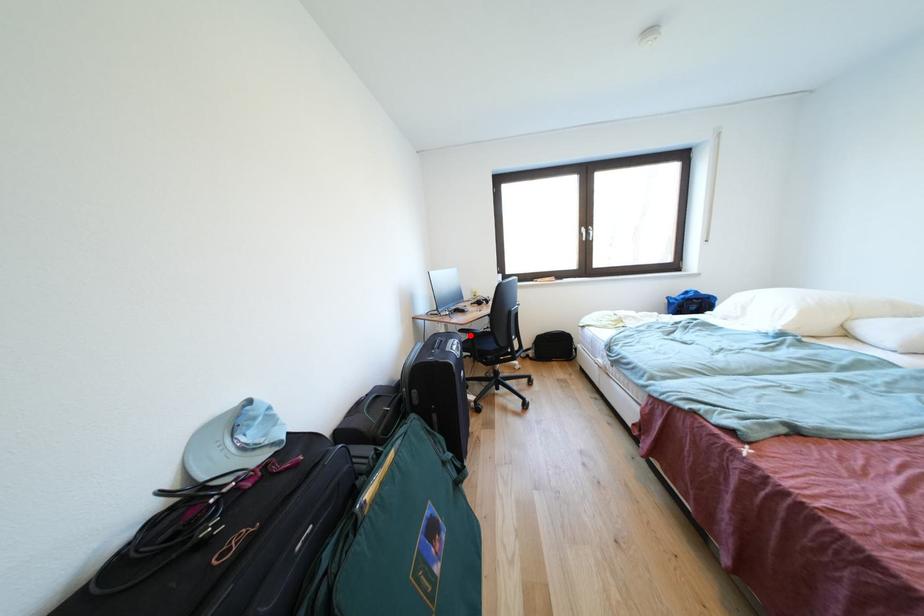
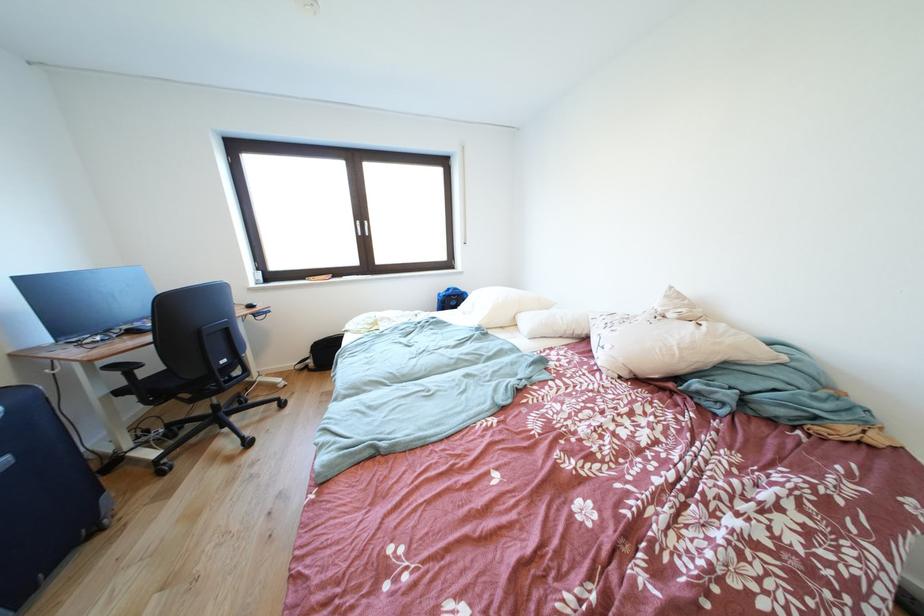
Locate, in the second image, the point that corresponds to the highlighted location in the first image.

(120, 371)